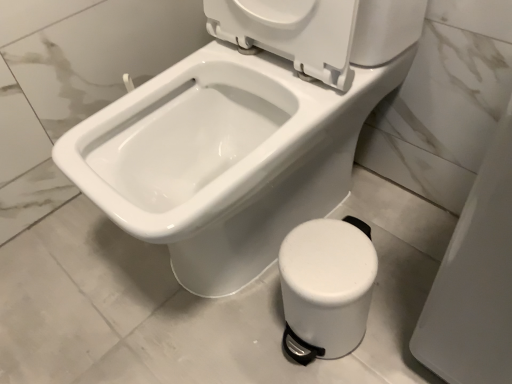
You are a GUI agent. You are given a task and a screenshot of the screen. Output one action in this format:
    pyautogui.click(x=<x>, y=<y>)
    Task: Click on the vacant space that is to the left of white glossy bidet at center
    
    Given the screenshot: What is the action you would take?
    pyautogui.click(x=69, y=283)